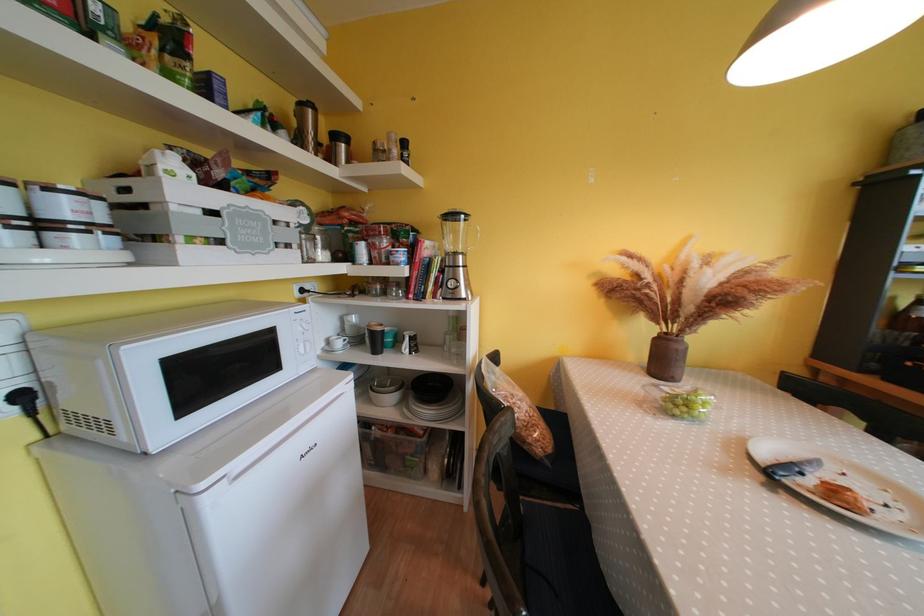
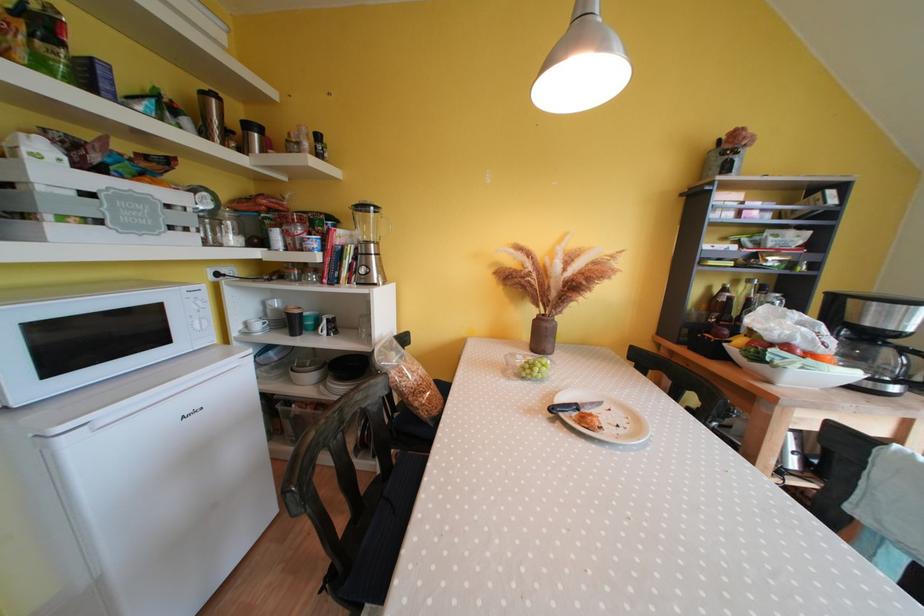
Find the pixel in the second image that matches the point at 892,509 in the first image.

(624, 430)